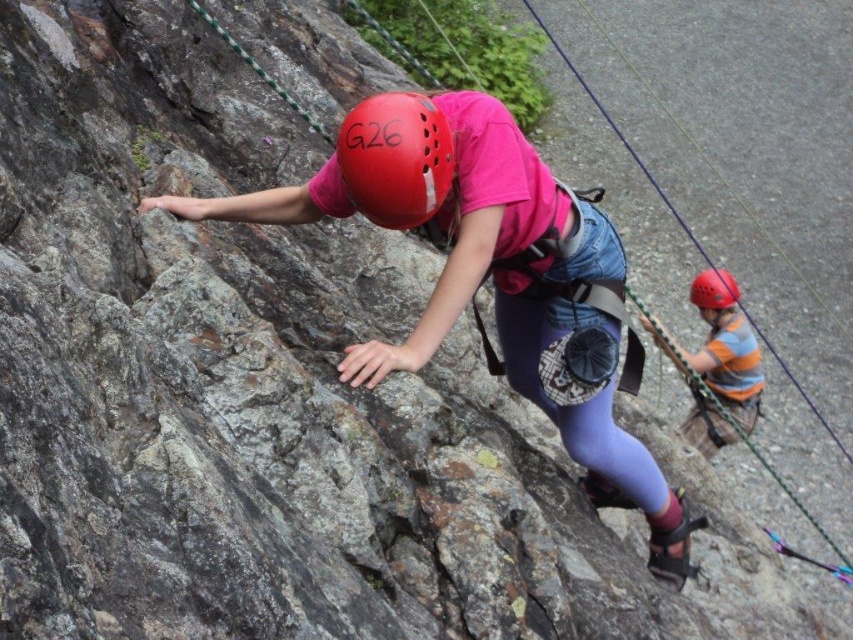
You are a safety inspector assessing the climbing setup. You notice the matte red helmet at center and the striped cotton shirt at right. According to safety protocols, climbers must maintain a minimum distance of 2 meters between each other to avoid collisions. Can you determine if this distance is maintained between the two climbers?

The matte red helmet at center is in front of the striped cotton shirt at right, which means they are positioned along the same line of sight. However, without specific distance measurements, it is impossible to confirm if the 2 meter safety distance is maintained between the matte red helmet at center and the striped cotton shirt at right.

What is the exact coordinate of the matte pink shirt at center?

The matte pink shirt at center is located at point (488, 273).